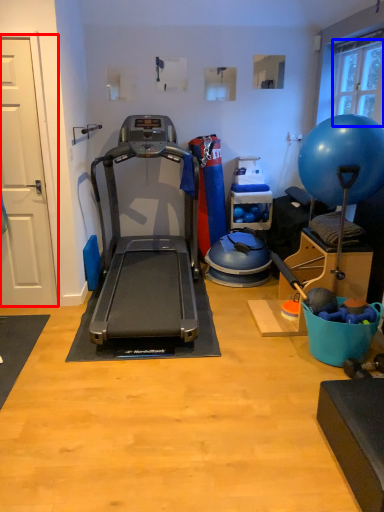
Question: Which point is further to the camera, door (highlighted by a red box) or window screen (highlighted by a blue box)?

Choices:
 (A) door
 (B) window screen

Answer: (B)